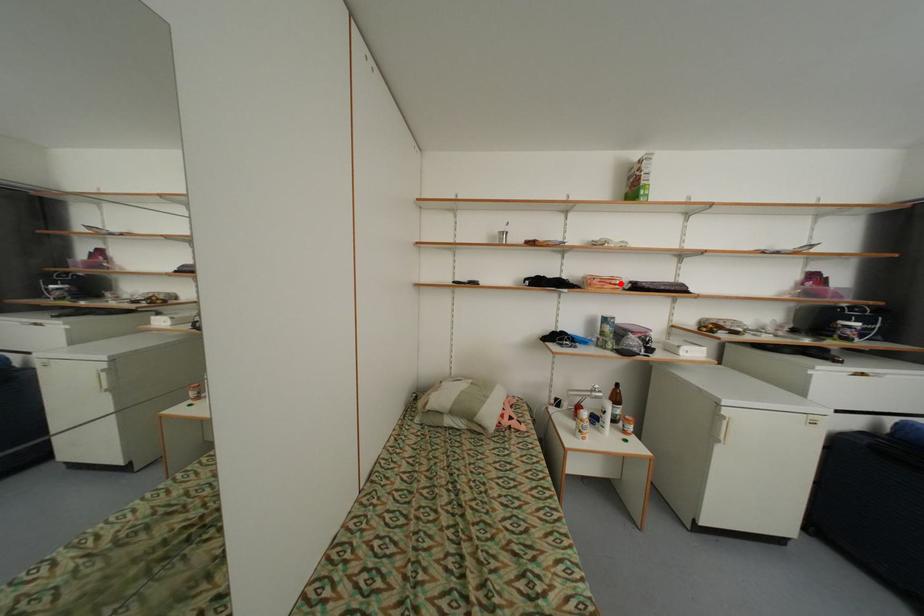
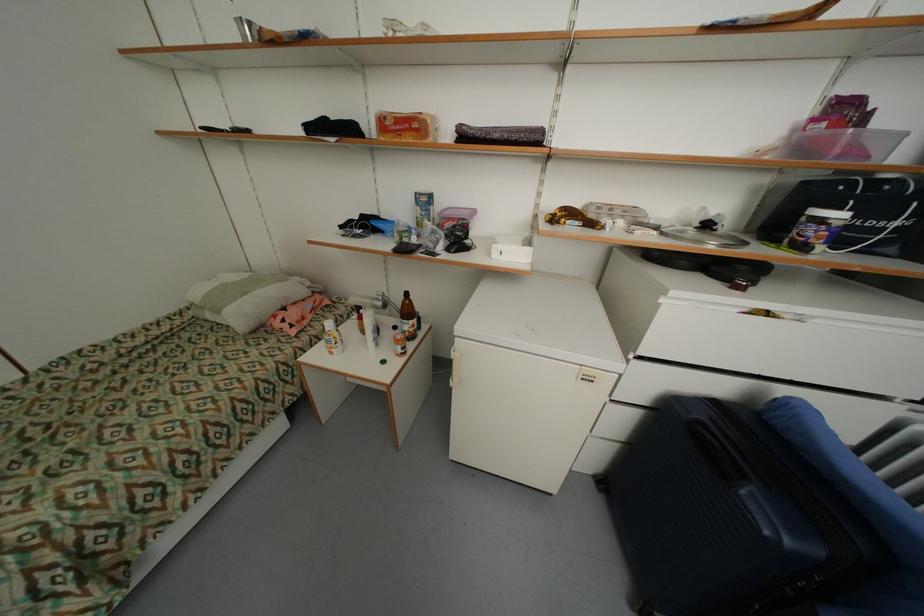
In the second image, find the point that corresponds to the highlighted location in the first image.

(421, 126)